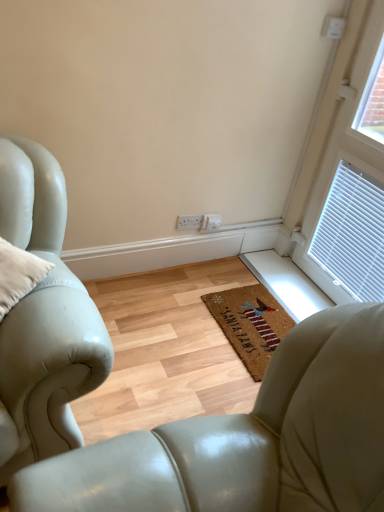
Question: Should I look upward or downward to see coir mat at center?

Choices:
 (A) up
 (B) down

Answer: (B)

Question: Is white plastic window at upper right directly adjacent to leather armchair at center?

Choices:
 (A) no
 (B) yes

Answer: (A)

Question: Is white plastic window at upper right not within leather armchair at center?

Choices:
 (A) no
 (B) yes

Answer: (B)

Question: Is white plastic window at upper right oriented towards leather armchair at center?

Choices:
 (A) yes
 (B) no

Answer: (A)

Question: Is white plastic window at upper right further to the viewer compared to leather armchair at center?

Choices:
 (A) yes
 (B) no

Answer: (A)

Question: Is white plastic window at upper right positioned with its back to leather armchair at center?

Choices:
 (A) no
 (B) yes

Answer: (A)

Question: Is white plastic window at upper right to the left of leather armchair at center from the viewer's perspective?

Choices:
 (A) yes
 (B) no

Answer: (B)

Question: Could you tell me if coir mat at center is facing white plastic window at upper right?

Choices:
 (A) no
 (B) yes

Answer: (A)

Question: Is coir mat at center thinner than white plastic window at upper right?

Choices:
 (A) yes
 (B) no

Answer: (B)

Question: From the image's perspective, would you say coir mat at center is shown under white plastic window at upper right?

Choices:
 (A) no
 (B) yes

Answer: (B)

Question: Does coir mat at center have a greater width compared to white plastic window at upper right?

Choices:
 (A) yes
 (B) no

Answer: (A)

Question: Is coir mat at center facing away from white plastic window at upper right?

Choices:
 (A) yes
 (B) no

Answer: (B)

Question: Can you confirm if coir mat at center is shorter than white plastic window at upper right?

Choices:
 (A) yes
 (B) no

Answer: (A)

Question: Is the position of white plastic window at upper right less distant than that of coir mat at center?

Choices:
 (A) no
 (B) yes

Answer: (B)